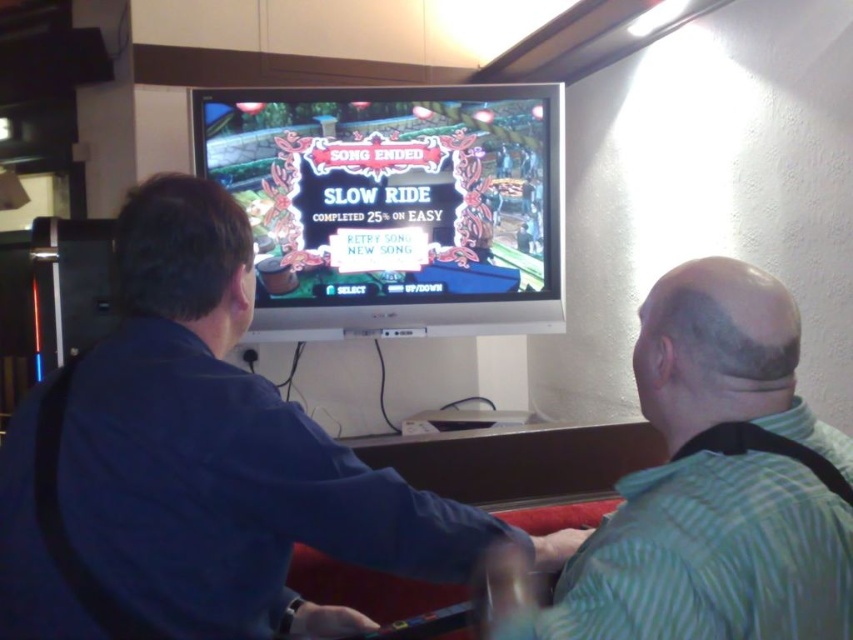
Can you confirm if blue shirt at center is wider than green striped shirt at right?

Yes.

Is blue shirt at center below green striped shirt at right?

Correct, blue shirt at center is located below green striped shirt at right.

What do you see at coordinates (228, 451) in the screenshot? I see `blue shirt at center` at bounding box center [228, 451].

The width and height of the screenshot is (853, 640). I want to click on blue shirt at center, so click(228, 451).

Identify the location of blue shirt at center. (228, 451).

Does blue shirt at center have a greater width compared to matte plastic video game at center?

Incorrect, blue shirt at center's width does not surpass matte plastic video game at center's.

Is point (4, 556) closer to viewer compared to point (344, 163)?

That is True.

Find the location of a particular element. blue shirt at center is located at coordinates (228, 451).

Identify the location of matte plastic video game at center. (393, 204).

Is matte plastic video game at center to the left of green striped shirt at right from the viewer's perspective?

Yes, matte plastic video game at center is to the left of green striped shirt at right.

Who is more distant from viewer, (540, 262) or (695, 364)?

Positioned behind is point (540, 262).

What are the coordinates of `matte plastic video game at center` in the screenshot? It's located at (393, 204).